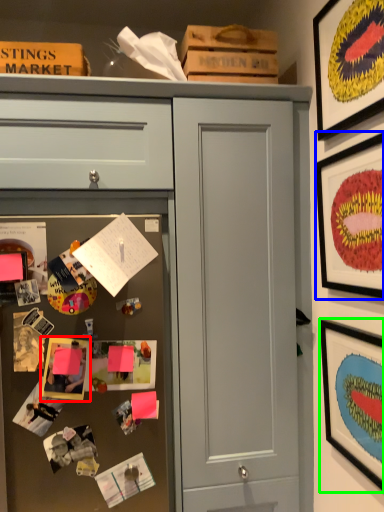
Question: Based on their relative distances, which object is nearer to picture frame (highlighted by a red box)? Choose from picture frame (highlighted by a blue box) and picture frame (highlighted by a green box).

Choices:
 (A) picture frame
 (B) picture frame

Answer: (B)